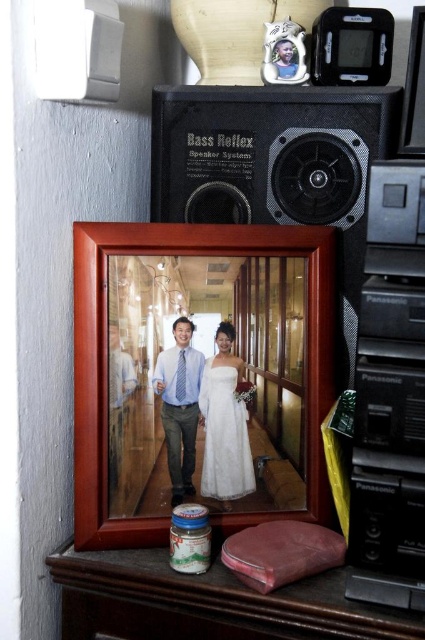
Can you confirm if black matte speaker system at upper center is wider than white lace dress at center?

Yes, black matte speaker system at upper center is wider than white lace dress at center.

Which is behind, point (158, 209) or point (226, 369)?

The point (158, 209) is behind.

The height and width of the screenshot is (640, 425). I want to click on black matte speaker system at upper center, so click(x=277, y=168).

At what (x,y) coordinates should I click in order to perform the action: click on black matte speaker system at upper center. Please return your answer as a coordinate pair (x, y). The width and height of the screenshot is (425, 640). Looking at the image, I should click on (277, 168).

Is wooden photo frame at center to the right of matte blue shirt at center from the viewer's perspective?

Yes, wooden photo frame at center is to the right of matte blue shirt at center.

Can you confirm if wooden photo frame at center is taller than matte blue shirt at center?

Yes, wooden photo frame at center is taller than matte blue shirt at center.

Which is in front, point (258, 349) or point (167, 467)?

Point (167, 467) is more forward.

The image size is (425, 640). In order to click on wooden photo frame at center in this screenshot , I will do `click(197, 372)`.

Who is positioned more to the left, brown leather wallet at lower center or white lace dress at center?

Positioned to the left is brown leather wallet at lower center.

Which is behind, point (278, 630) or point (223, 486)?

The point (223, 486) is behind.

Find the location of a particular element. Image resolution: width=425 pixels, height=640 pixels. brown leather wallet at lower center is located at coordinates (209, 602).

The height and width of the screenshot is (640, 425). I want to click on brown leather wallet at lower center, so click(209, 602).